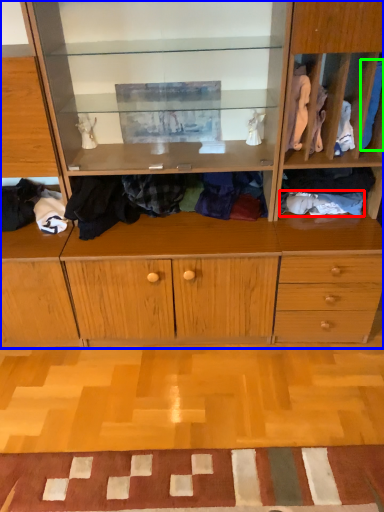
Question: Based on their relative distances, which object is farther from clothing (highlighted by a red box)? Choose from cabinetry (highlighted by a blue box) and clothing (highlighted by a green box).

Choices:
 (A) cabinetry
 (B) clothing

Answer: (A)